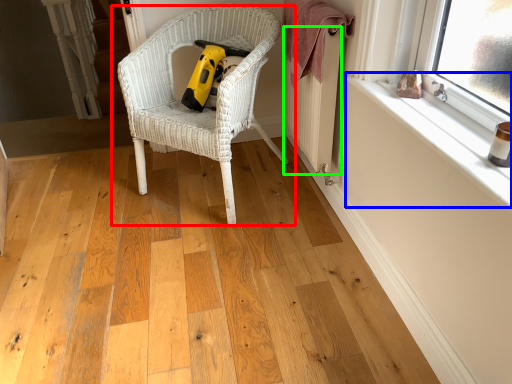
Question: Considering the real-world distances, which object is farthest from chair (highlighted by a red box)? window sill (highlighted by a blue box) or radiator (highlighted by a green box)?

Choices:
 (A) window sill
 (B) radiator

Answer: (A)